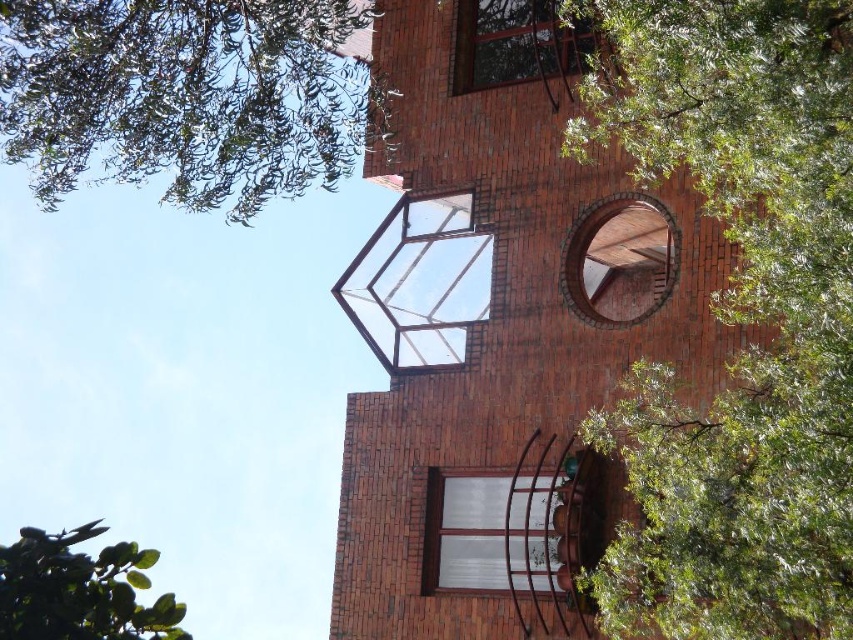
You are a window installer who needs to place a new 10 feet wide decorative panel between the red brick window at upper right and the white glass window at center. Based on the scene description, can the panel fit between them?

The distance between the red brick window at upper right and the white glass window at center is 12.05 feet. Since the panel is 10 feet wide, it can fit between them with 2.05 feet of space remaining.

You are an architect designing a new building and want to ensure proper spacing between the clear glass window at center and the red brick window at upper right. Based on the image, which window has a larger width?

The red brick window at upper right has a larger width than the clear glass window at center.

You are standing in front of the modern brick building and want to locate the clear glass window at center. According to the coordinates provided, where should you look?

The clear glass window at center is located at point coordinates [419,282].